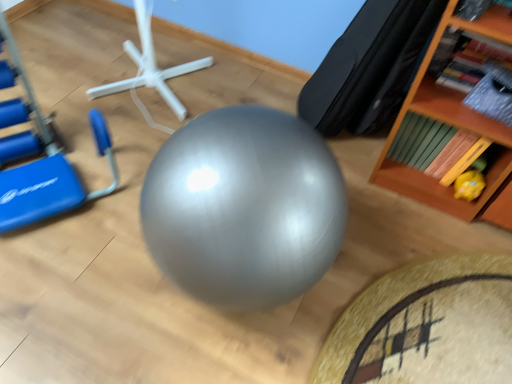
Question: Is black leather bean bag chair at upper right at the right side of wooden bookshelf at upper right?

Choices:
 (A) no
 (B) yes

Answer: (A)

Question: Would you consider black leather bean bag chair at upper right to be distant from wooden bookshelf at upper right?

Choices:
 (A) yes
 (B) no

Answer: (B)

Question: From the image's perspective, is black leather bean bag chair at upper right located above wooden bookshelf at upper right?

Choices:
 (A) no
 (B) yes

Answer: (B)

Question: Considering the relative sizes of black leather bean bag chair at upper right and wooden bookshelf at upper right in the image provided, is black leather bean bag chair at upper right bigger than wooden bookshelf at upper right?

Choices:
 (A) yes
 (B) no

Answer: (B)

Question: Does black leather bean bag chair at upper right have a lesser width compared to wooden bookshelf at upper right?

Choices:
 (A) yes
 (B) no

Answer: (B)

Question: Is the position of black leather bean bag chair at upper right more distant than that of wooden bookshelf at upper right?

Choices:
 (A) yes
 (B) no

Answer: (A)

Question: Is yellow rubber duck at lower right far from white plastic stand at center?

Choices:
 (A) yes
 (B) no

Answer: (A)

Question: From a real-world perspective, is yellow rubber duck at lower right under white plastic stand at center?

Choices:
 (A) no
 (B) yes

Answer: (B)

Question: From the image's perspective, is yellow rubber duck at lower right on top of white plastic stand at center?

Choices:
 (A) no
 (B) yes

Answer: (A)

Question: Can you confirm if yellow rubber duck at lower right is positioned to the left of white plastic stand at center?

Choices:
 (A) yes
 (B) no

Answer: (B)

Question: Considering the relative sizes of yellow rubber duck at lower right and white plastic stand at center in the image provided, is yellow rubber duck at lower right shorter than white plastic stand at center?

Choices:
 (A) no
 (B) yes

Answer: (B)

Question: Does yellow rubber duck at lower right have a smaller size compared to white plastic stand at center?

Choices:
 (A) no
 (B) yes

Answer: (B)

Question: Is yellow rubber duck at lower right looking in the opposite direction of black leather bean bag chair at upper right?

Choices:
 (A) yes
 (B) no

Answer: (B)